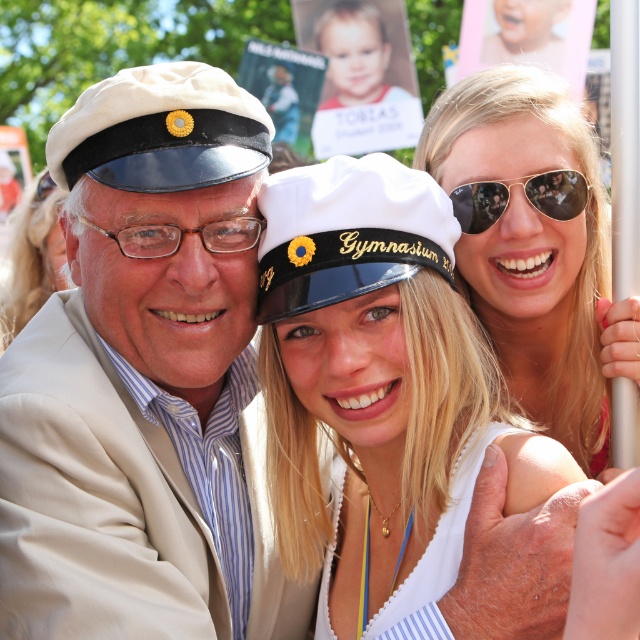
Is matte white cap at center shorter than blonde hair at center?

No.

Between matte white cap at center and blonde hair at center, which one appears on the left side from the viewer's perspective?

Positioned to the left is blonde hair at center.

Identify the location of matte white cap at center. This screenshot has height=640, width=640. pyautogui.click(x=145, y=380).

Between sunglasses at upper right and gold reflective aviator sunglasses at upper center, which one appears on the right side from the viewer's perspective?

sunglasses at upper right

What are the coordinates of `sunglasses at upper right` in the screenshot? It's located at (536, 248).

What do you see at coordinates (536, 248) in the screenshot? This screenshot has height=640, width=640. I see `sunglasses at upper right` at bounding box center [536, 248].

This screenshot has width=640, height=640. Find the location of `sunglasses at upper right`. sunglasses at upper right is located at coordinates (536, 248).

Between white glossy cap at center and blonde hair at center, which one has more height?

Standing taller between the two is white glossy cap at center.

Does white glossy cap at center have a smaller size compared to blonde hair at center?

No.

The width and height of the screenshot is (640, 640). I want to click on white glossy cap at center, so pyautogui.click(x=364, y=348).